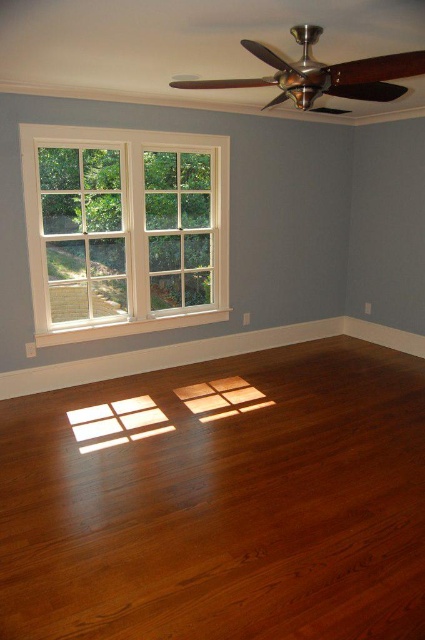
You are standing in the room and want to move from the white painted wood window at left to the shiny brown hardwood floor at center. Which direction should you move to reach it?

You should move to the right to reach the shiny brown hardwood floor at center from the white painted wood window at left since it is located to the right of it.

You are standing in the room and want to walk towards the white painted wood window at left. Which direction should you move relative to the shiny brown hardwood floor at center?

You should move away from the shiny brown hardwood floor at center towards the white painted wood window at left since the floor is in front of the window, meaning the window is behind the floor from your perspective.